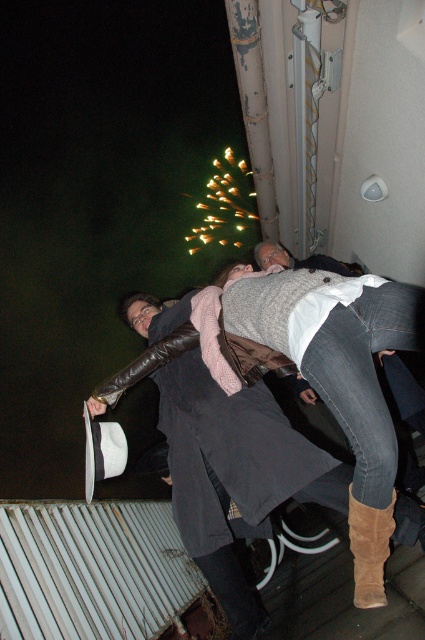
You are standing in the crowd watching the fireworks and want to hand a gift to the person wearing the matte black coat at center. Based on their position, where should you approach from?

The matte black coat at center is located at point (223, 452), so you should approach from the center area to reach them.

You are a photographer standing at the back of the scene. You want to take a photo of the matte black coat at center and the suede boot at lower right. How far apart are these two objects in the image?

The matte black coat at center is 77.20 centimeters away from the suede boot at lower right, so they are 77.20 centimeters apart in the image.